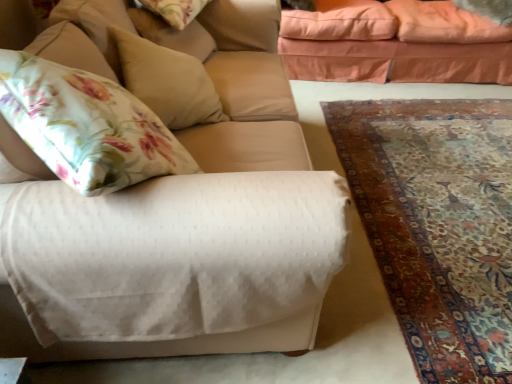
Question: Looking at the image, does beige fabric pillow at upper left, which ranks as the 1th pillow in bottom-to-top order, seem bigger or smaller compared to white textured fabric couch at center, acting as the second studio couch starting from the right?

Choices:
 (A) small
 (B) big

Answer: (A)

Question: Is point (137, 49) positioned closer to the camera than point (220, 36)?

Choices:
 (A) farther
 (B) closer

Answer: (B)

Question: Based on their relative distances, which object is nearer to the peach fabric studio couch at upper right, which is the 1th studio couch in back-to-front order?

Choices:
 (A) carpet with intricate patterns at lower right
 (B) fluffy beige pillow at upper right, marked as the 1th pillow in a back-to-front arrangement
 (C) floral fabric pillow at upper left, marked as the second pillow in a front-to-back arrangement
 (D) white textured fabric couch at center, which is the 1th studio couch from front to back
 (E) beige fabric pillow at upper left, the third pillow viewed from the back

Answer: (B)

Question: Which object is the closest to the floral fabric pillow at upper left, the 2th pillow when ordered from back to front?

Choices:
 (A) fluffy beige pillow at upper right, positioned as the 3th pillow in bottom-to-top order
 (B) peach fabric studio couch at upper right, which is the 1th studio couch in back-to-front order
 (C) beige fabric pillow at upper left, which ranks as the 1th pillow in bottom-to-top order
 (D) carpet with intricate patterns at lower right
 (E) white textured fabric couch at center, acting as the second studio couch starting from the right

Answer: (E)